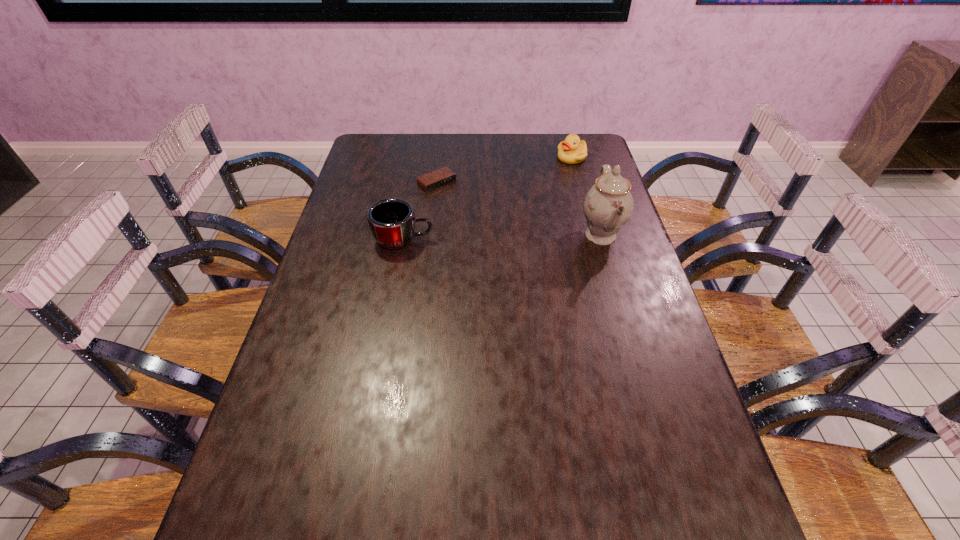
Locate an element on the screen. The image size is (960, 540). vacant spot on the desktop that is between the mug and the chinaware and is positioned on the front-facing side of the farthest object is located at coordinates (511, 238).

I want to click on vacant space on the desktop that is between the mug and the chinaware and is positioned on the front face of the third nearest object, so click(x=501, y=238).